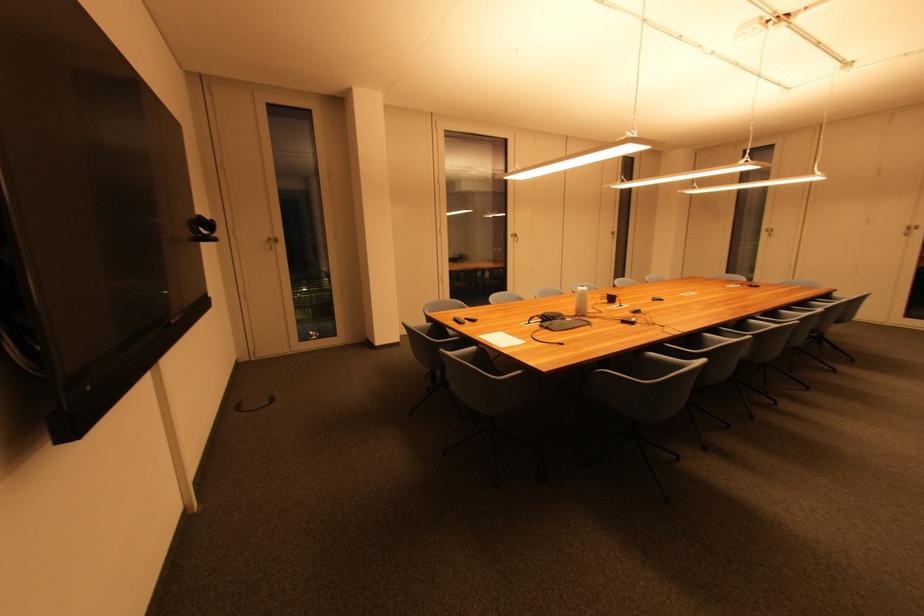
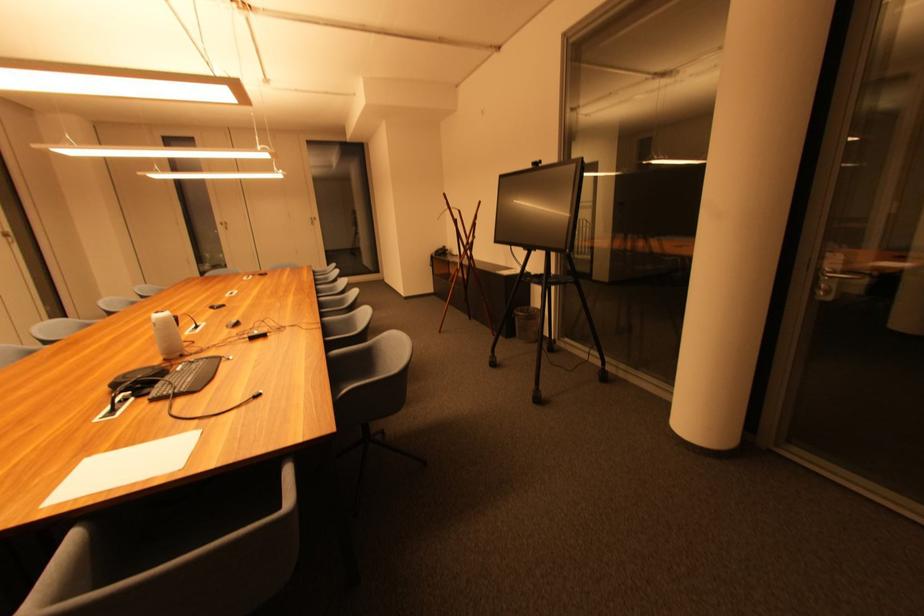
The point at [586,290] is marked in the first image. Where is the corresponding point in the second image?

(160, 318)